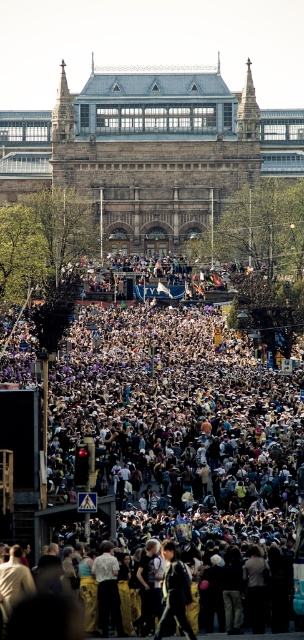
Question: Is white cotton crowd at center positioned at the back of black matte jacket at center?

Choices:
 (A) yes
 (B) no

Answer: (A)

Question: Does white cotton crowd at center have a lesser width compared to black matte jacket at center?

Choices:
 (A) yes
 (B) no

Answer: (B)

Question: Which point is closer to the camera taking this photo?

Choices:
 (A) (58, 428)
 (B) (172, 545)

Answer: (B)

Question: Which object appears closest to the camera in this image?

Choices:
 (A) black matte jacket at center
 (B) white cotton crowd at center

Answer: (A)

Question: Which point is farther to the camera?

Choices:
 (A) (114, 380)
 (B) (172, 566)

Answer: (A)

Question: Is white cotton crowd at center above black matte jacket at center?

Choices:
 (A) no
 (B) yes

Answer: (B)